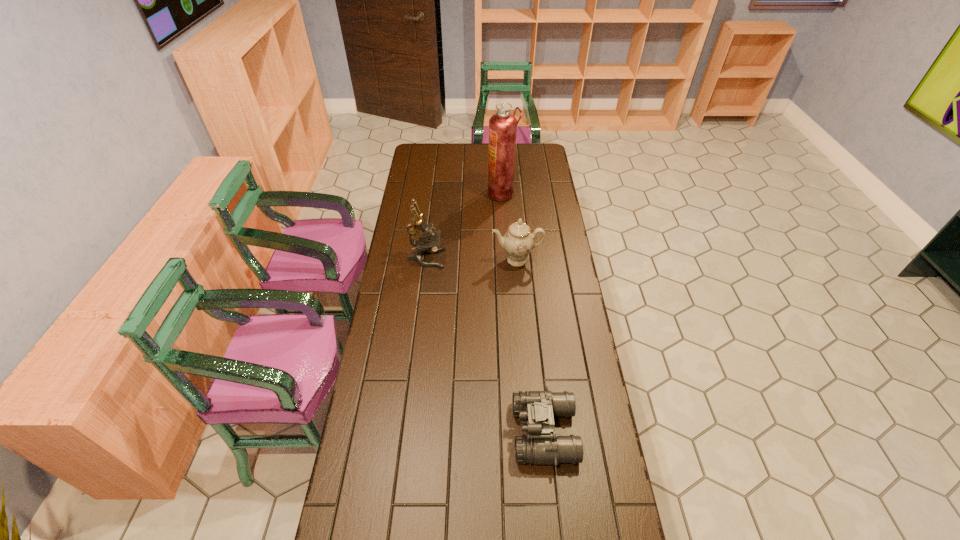
Image resolution: width=960 pixels, height=540 pixels. In the image, there is a desktop. Find the location of `blank space at the far left corner`. blank space at the far left corner is located at coordinates (417, 148).

Where is `vacant space at the far right corner`? vacant space at the far right corner is located at coordinates (534, 161).

The height and width of the screenshot is (540, 960). Identify the location of empty space that is in between the tallest object and the second tallest object. (465, 226).

You are a GUI agent. You are given a task and a screenshot of the screen. Output one action in this format:
    pyautogui.click(x=<x>, y=<y>)
    Task: Click on the free space between the fire extinguisher and the second tallest object
    Image resolution: width=960 pixels, height=540 pixels.
    Given the screenshot: What is the action you would take?
    pyautogui.click(x=465, y=226)

At what (x,y) coordinates should I click in order to perform the action: click on vacant area between the shortest object and the chinaware. Please return your answer as a coordinate pair (x, y). This screenshot has width=960, height=540. Looking at the image, I should click on (531, 346).

At what (x,y) coordinates should I click in order to perform the action: click on free spot between the nearest object and the second shortest object. Please return your answer as a coordinate pair (x, y). Looking at the image, I should click on (531, 346).

Locate an element on the screen. This screenshot has height=540, width=960. free spot between the second tallest object and the farthest object is located at coordinates point(465,226).

You are a GUI agent. You are given a task and a screenshot of the screen. Output one action in this format:
    pyautogui.click(x=<x>, y=<y>)
    Task: Click on the empty location between the farthest object and the leftmost object
    This screenshot has height=540, width=960.
    Given the screenshot: What is the action you would take?
    pyautogui.click(x=465, y=226)

Image resolution: width=960 pixels, height=540 pixels. Identify the location of object that is the closest to the leftmost object. (518, 241).

Locate which object ranks third in proximity to the binoculars. Please provide its 2D coordinates. Your answer should be formatted as a tuple, i.e. [(x, y)], where the tuple contains the x and y coordinates of a point satisfying the conditions above.

[(502, 126)]